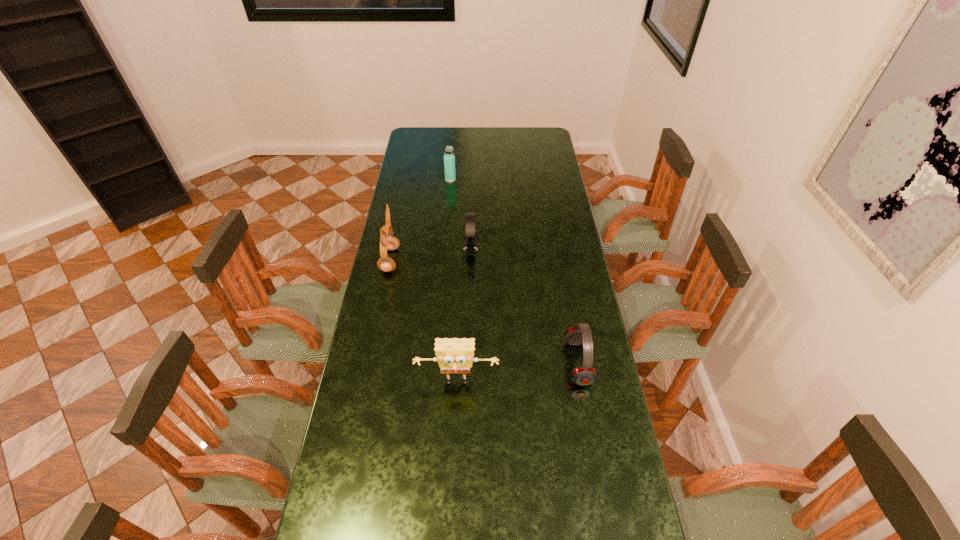
Find the location of a particular element. This screenshot has width=960, height=540. free space that satisfies the following two spatial constraints: 1. on the ear cups of the nearest earphone; 2. on the face of the sponge is located at coordinates (582, 383).

In order to click on vacant space that satisfies the following two spatial constraints: 1. on the ear cups of the rightmost object; 2. on the face of the sponge in this screenshot , I will do `click(582, 383)`.